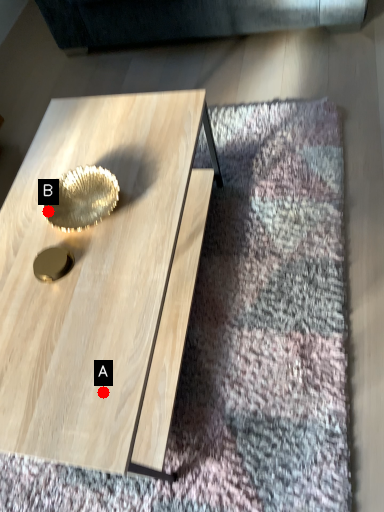
Question: Two points are circled on the image, labeled by A and B beside each circle. Which of the following is the farthest from the observer?

Choices:
 (A) A is further
 (B) B is further

Answer: (B)